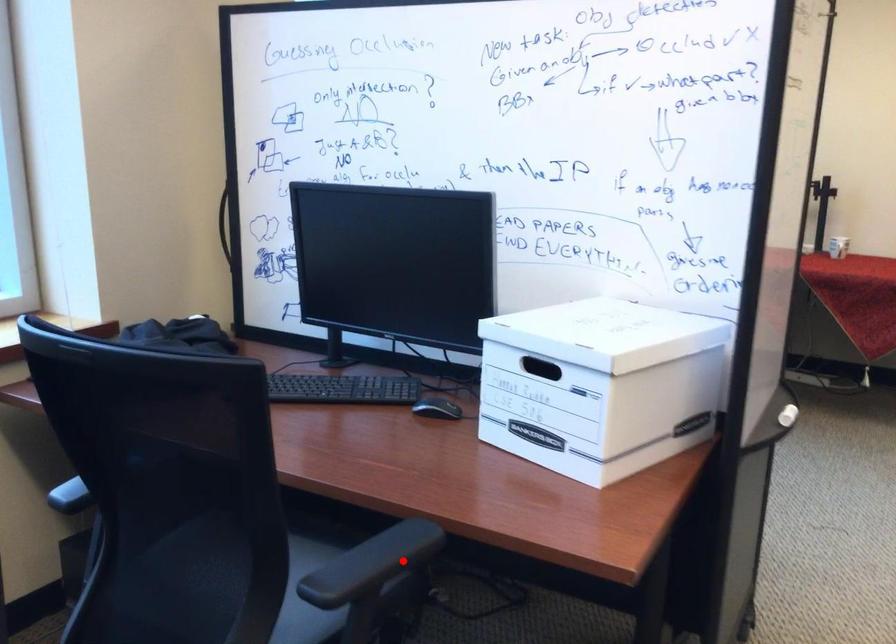
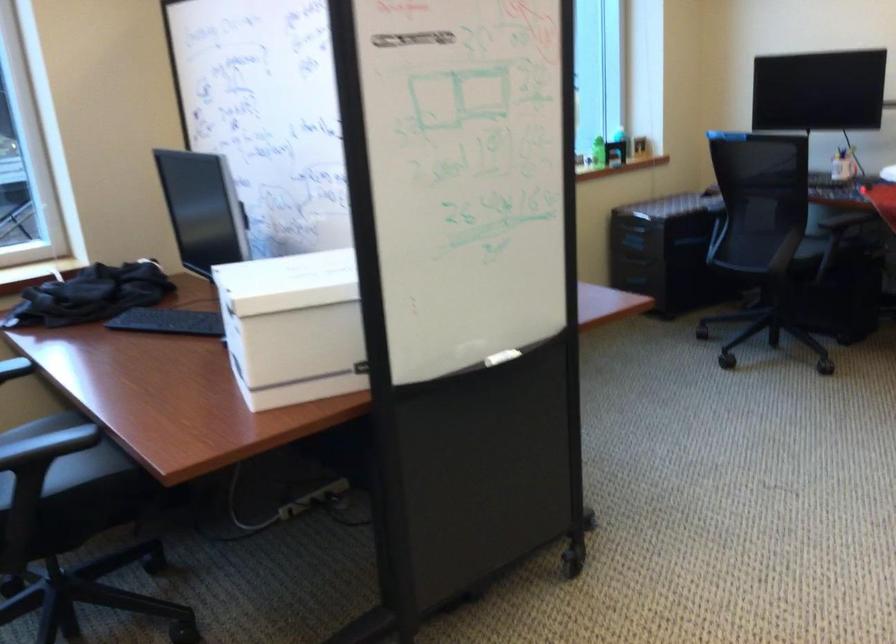
Question: I am providing you with two images of the same scene from different viewpoints. A red point is marked on the first image. At the location where the point appears in image 1, is it still visible in image 2?

Choices:
 (A) Yes
 (B) No

Answer: (A)